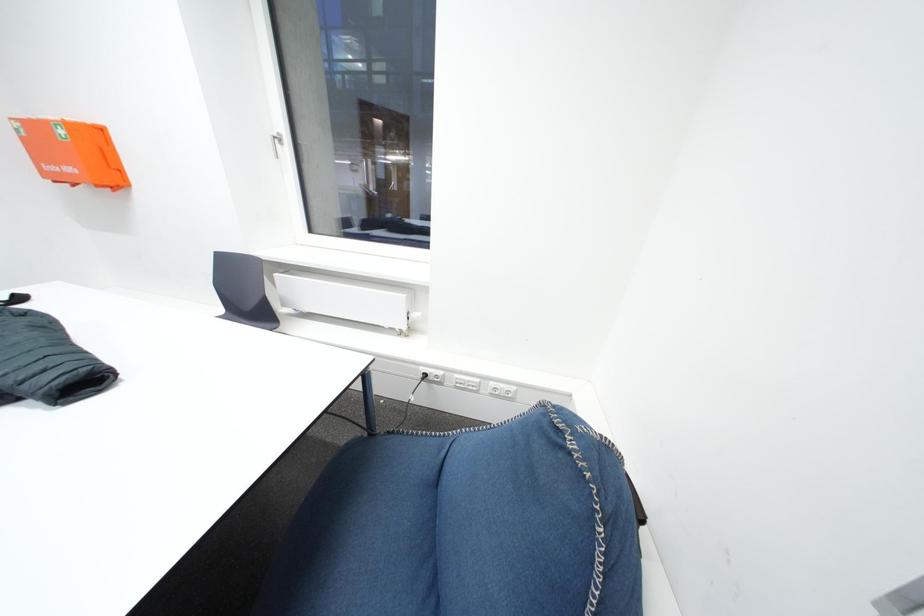
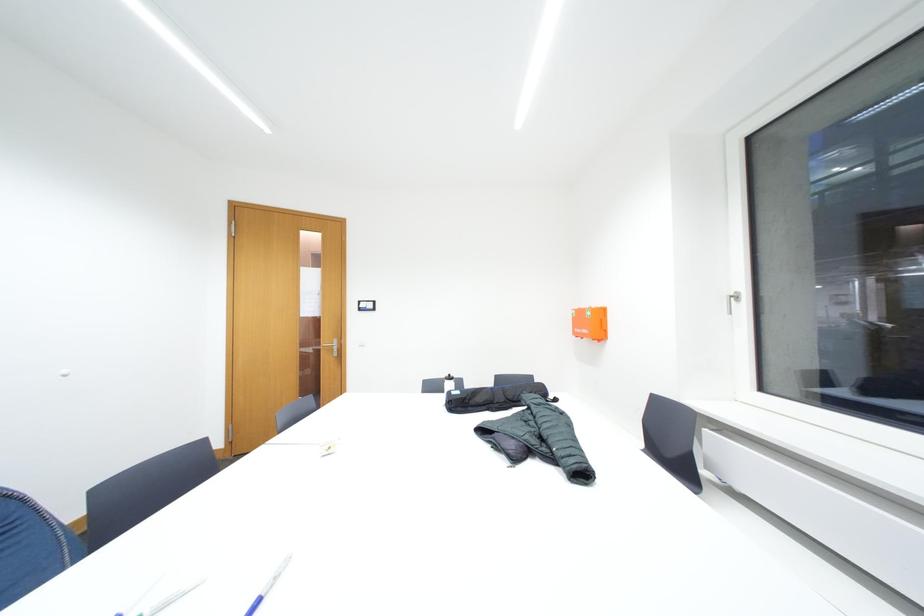
Question: The camera is either moving clockwise (left) or counter-clockwise (right) around the object. The first image is from the beginning of the video and the second image is from the end. Is the camera moving left or right when shooting the video?

Choices:
 (A) Left
 (B) Right

Answer: (B)